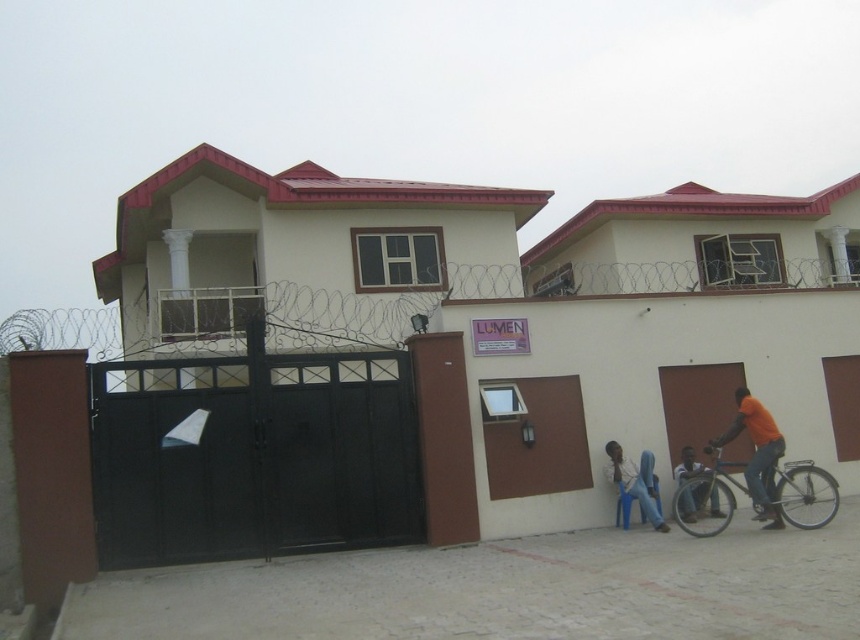
Question: Which of the following is the closest to the observer?

Choices:
 (A) light blue plastic chair at lower right
 (B) orange shirt at lower right

Answer: (B)

Question: Based on their relative distances, which object is nearer to the orange shirt at lower right?

Choices:
 (A) blue metallic bicycle at lower right
 (B) light blue plastic chair at lower right
 (C) orange cotton shirt at right

Answer: (A)

Question: Is orange cotton shirt at right in front of light blue plastic chair at lower right?

Choices:
 (A) yes
 (B) no

Answer: (A)

Question: Where is blue metallic bicycle at lower right located in relation to orange cotton shirt at right in the image?

Choices:
 (A) above
 (B) below

Answer: (B)

Question: Is light blue plastic chair at lower right thinner than orange shirt at lower right?

Choices:
 (A) yes
 (B) no

Answer: (A)

Question: Among these points, which one is nearest to the camera?

Choices:
 (A) (821, 516)
 (B) (606, 470)
 (C) (771, 436)
 (D) (682, 483)

Answer: (C)